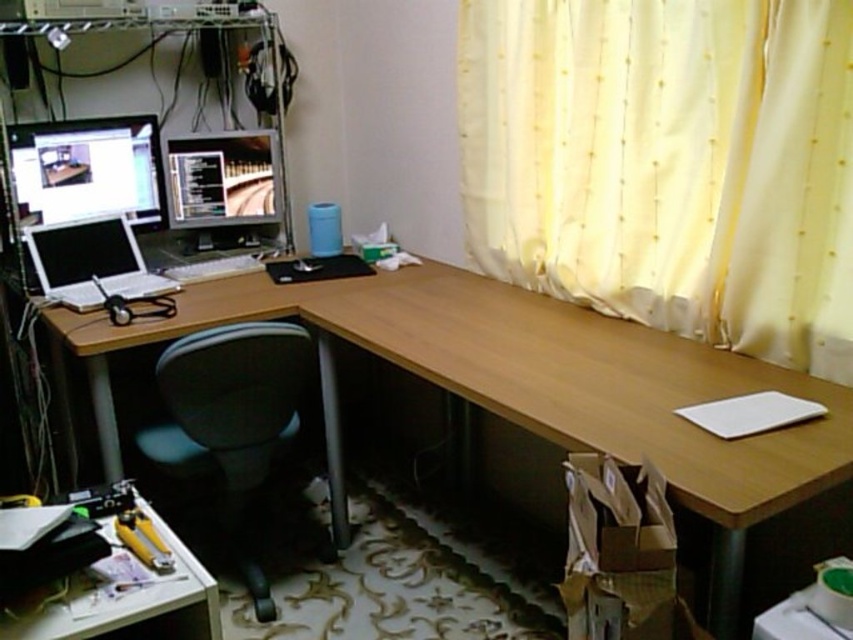
Question: Is black fabric swivel chair at lower left below yellow plastic tool at lower left?

Choices:
 (A) no
 (B) yes

Answer: (A)

Question: Which point is farther from the camera taking this photo?

Choices:
 (A) (22, 628)
 (B) (242, 353)
 (C) (173, 141)
 (D) (636, 97)

Answer: (C)

Question: Is white plastic table at lower left below yellow plastic tool at lower left?

Choices:
 (A) yes
 (B) no

Answer: (A)

Question: Which object appears closest to the camera in this image?

Choices:
 (A) white plastic table at lower left
 (B) white sheer curtain at upper right
 (C) yellow plastic tool at lower left
 (D) matte black monitor at center

Answer: (A)

Question: Which point is farther from the camera taking this photo?

Choices:
 (A) (198, 467)
 (B) (198, 248)
 (C) (126, 540)

Answer: (B)

Question: In this image, where is white sheer curtain at upper right located relative to yellow plastic tool at lower left?

Choices:
 (A) below
 (B) above

Answer: (B)